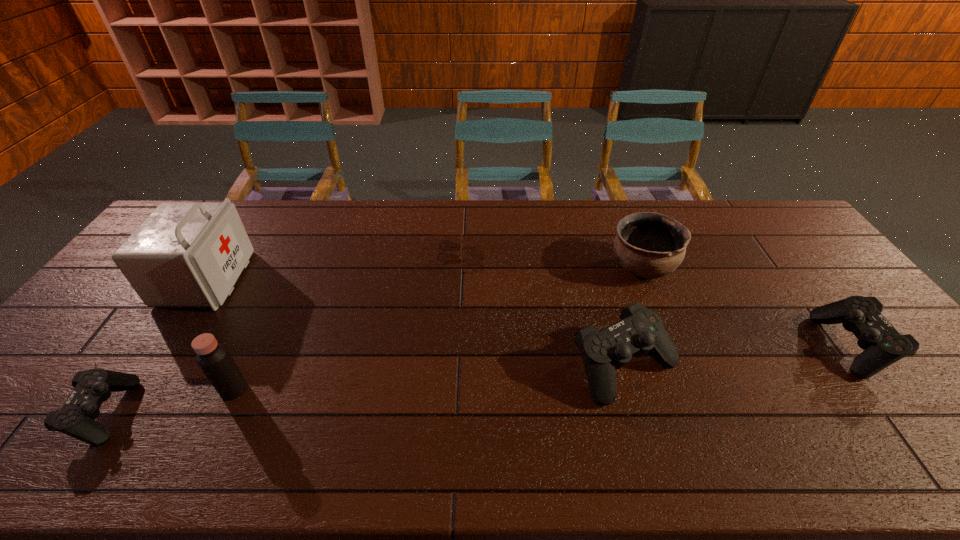
I want to click on the shortest control, so click(x=92, y=387).

The image size is (960, 540). Identify the location of the leftmost control. (92, 387).

Locate an element on the screen. The image size is (960, 540). the fourth tallest object is located at coordinates (640, 330).

Locate an element on the screen. the second control from left to right is located at coordinates (640, 330).

This screenshot has height=540, width=960. I want to click on the rightmost control, so click(x=883, y=345).

The image size is (960, 540). In order to click on the third shortest object in this screenshot , I will do `click(883, 345)`.

The width and height of the screenshot is (960, 540). In order to click on the tallest object in this screenshot , I will do `click(184, 254)`.

The width and height of the screenshot is (960, 540). In order to click on pottery in this screenshot , I will do `click(650, 245)`.

This screenshot has width=960, height=540. Identify the location of vinegar. (213, 358).

I want to click on the fifth object from right to left, so click(x=213, y=358).